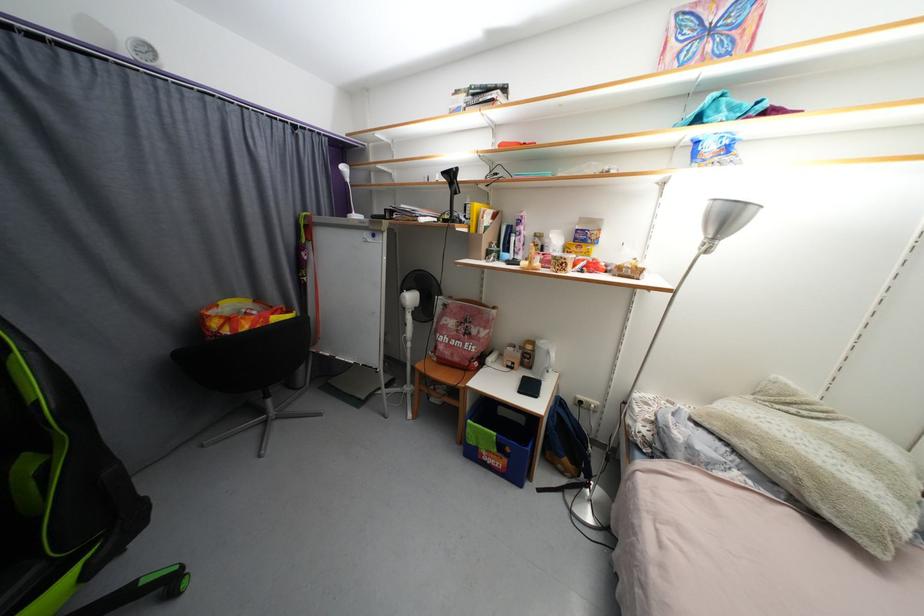
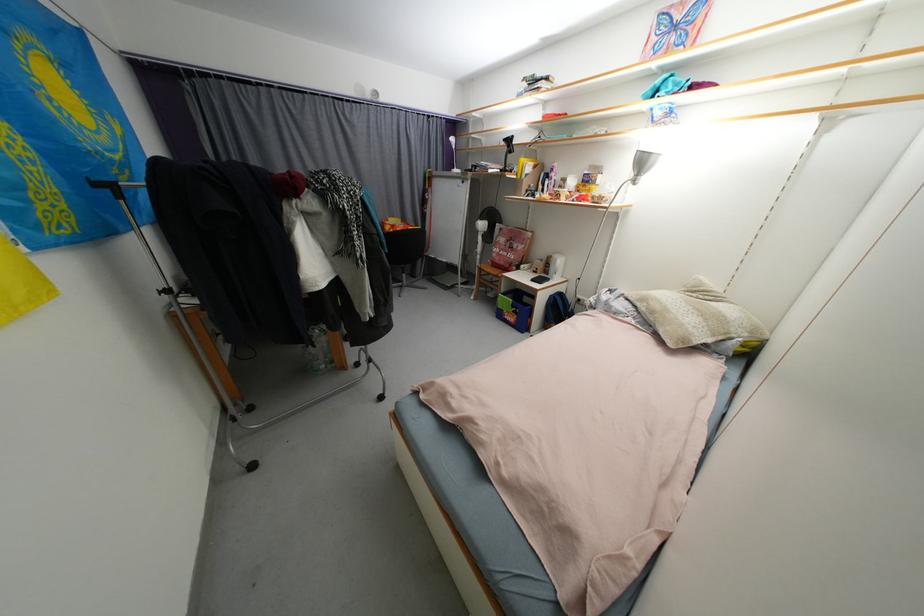
Find the pixel in the second image that matches [538,344] in the first image.

(557, 257)